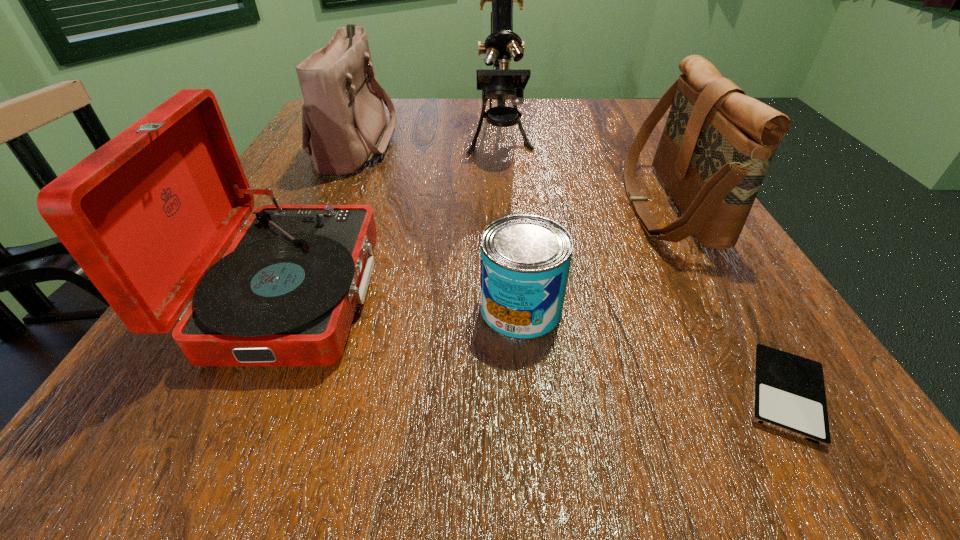
This screenshot has height=540, width=960. What are the coordinates of `iPod located in the right edge section of the desktop` in the screenshot? It's located at (789, 396).

The height and width of the screenshot is (540, 960). I want to click on object present at the far left corner, so click(x=344, y=126).

You are a GUI agent. You are given a task and a screenshot of the screen. Output one action in this format:
    pyautogui.click(x=<x>, y=<y>)
    Task: Click on the object that is positioned at the near right corner
    
    Given the screenshot: What is the action you would take?
    pyautogui.click(x=789, y=396)

The width and height of the screenshot is (960, 540). In the image, there is a desktop. Find the location of `vacant area at the far edge`. vacant area at the far edge is located at coordinates (403, 122).

At what (x,y) coordinates should I click in order to perform the action: click on free region at the left edge. Please return your answer as a coordinate pair (x, y). The width and height of the screenshot is (960, 540). Looking at the image, I should click on (315, 176).

Where is `free space at the right edge of the desktop`? The width and height of the screenshot is (960, 540). free space at the right edge of the desktop is located at coordinates (752, 275).

This screenshot has height=540, width=960. In the image, there is a desktop. In order to click on blank space at the far right corner in this screenshot , I will do `click(623, 111)`.

Where is `empty space that is in between the iPod and the microscope`? empty space that is in between the iPod and the microscope is located at coordinates (642, 267).

What are the coordinates of `empty space between the phonograph_record and the right shoulder bag` in the screenshot? It's located at (479, 249).

Locate an element on the screen. The height and width of the screenshot is (540, 960). vacant space in between the right shoulder bag and the microscope is located at coordinates point(584,173).